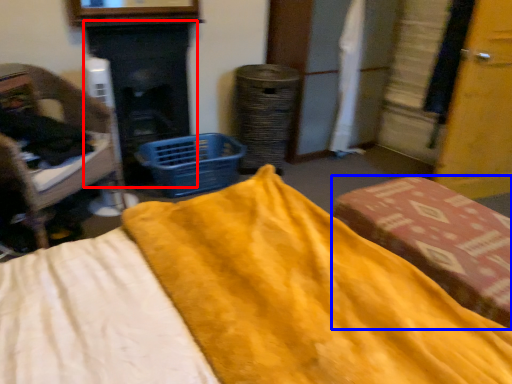
Question: Which point is further to the camera, fireplace (highlighted by a red box) or furniture (highlighted by a blue box)?

Choices:
 (A) fireplace
 (B) furniture

Answer: (A)